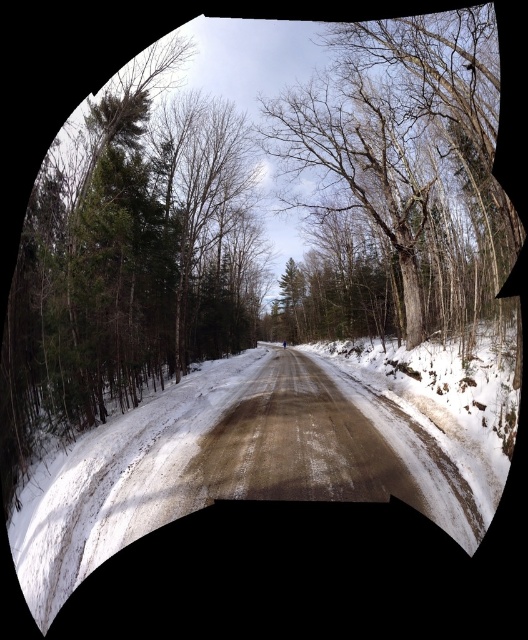
Does white powdery snow at center appear over bare wood tree at center?

No.

From the picture: Is white powdery snow at center shorter than bare wood tree at center?

Yes.

Who is more forward, (29, 536) or (404, 288)?

Point (29, 536)

Image resolution: width=528 pixels, height=640 pixels. Identify the location of white powdery snow at center. (268, 452).